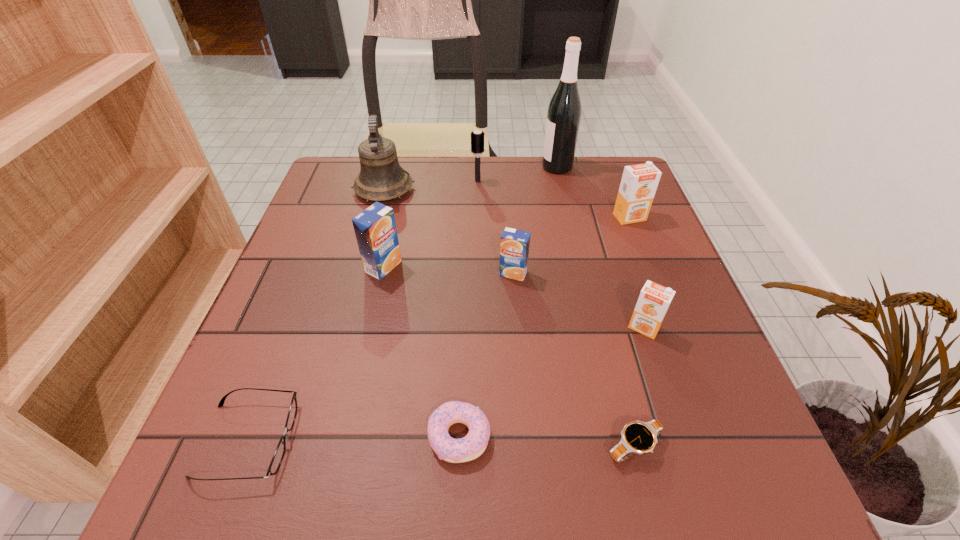
The image size is (960, 540). Identify the location of vacant area between the seventh farthest object and the right blue orange_juice. (579, 300).

At what (x,y) coordinates should I click in order to perform the action: click on free space between the right blue orange_juice and the wine bottle. Please return your answer as a coordinate pair (x, y). Looking at the image, I should click on (535, 220).

This screenshot has width=960, height=540. Find the location of `vacant area that lies between the smaller orange orange juice and the pink doughnut`. vacant area that lies between the smaller orange orange juice and the pink doughnut is located at coordinates click(x=551, y=382).

Image resolution: width=960 pixels, height=540 pixels. I want to click on blank region between the hairbrush and the leftmost orange juice, so click(431, 224).

In order to click on free spot between the fourth farthest object and the black watch in this screenshot , I will do click(x=632, y=332).

Choose which object is the second nearest neighbor to the black watch. Please provide its 2D coordinates. Your answer should be formatted as a tuple, i.e. [(x, y)], where the tuple contains the x and y coordinates of a point satisfying the conditions above.

[(470, 447)]

Where is `object that ranks as the fifth closest to the hairbrush`? This screenshot has width=960, height=540. object that ranks as the fifth closest to the hairbrush is located at coordinates (639, 182).

The width and height of the screenshot is (960, 540). Find the location of `orange juice that stands as the closest to the farther orange orange juice`. orange juice that stands as the closest to the farther orange orange juice is located at coordinates [x=514, y=249].

Select which orange juice is the third closest to the doughnut. Please provide its 2D coordinates. Your answer should be formatted as a tuple, i.e. [(x, y)], where the tuple contains the x and y coordinates of a point satisfying the conditions above.

[(375, 228)]

Where is `vacant point that satisfies the following two spatial constraints: 1. on the back side of the watch; 2. on the label of the wine bottle`? vacant point that satisfies the following two spatial constraints: 1. on the back side of the watch; 2. on the label of the wine bottle is located at coordinates (564, 167).